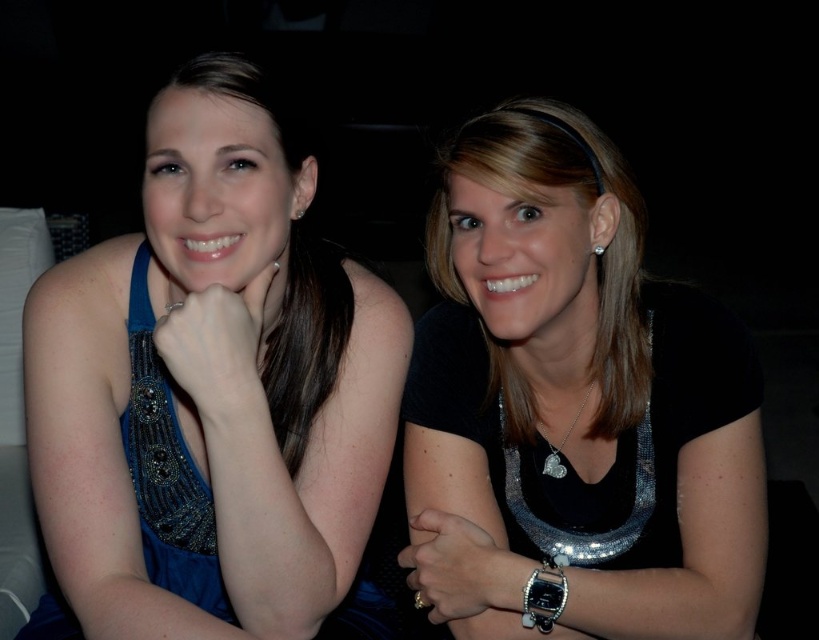
Does blue beaded dress at left have a lesser width compared to black sequined dress at center?

No.

Which is behind, point (120, 400) or point (444, 317)?

The point (444, 317) is behind.

This screenshot has height=640, width=819. I want to click on blue beaded dress at left, so click(211, 394).

Is black sequined dress at center further to camera compared to satin black blouse at center?

That is True.

At what (x,y) coordinates should I click in order to perform the action: click on black sequined dress at center. Please return your answer as a coordinate pair (x, y). Looking at the image, I should click on (573, 403).

Does blue beaded dress at left have a smaller size compared to satin black blouse at center?

Incorrect, blue beaded dress at left is not smaller in size than satin black blouse at center.

From the picture: Which of these two, blue beaded dress at left or satin black blouse at center, stands shorter?

With less height is satin black blouse at center.

I want to click on blue beaded dress at left, so click(211, 394).

This screenshot has height=640, width=819. In order to click on blue beaded dress at left in this screenshot , I will do `click(211, 394)`.